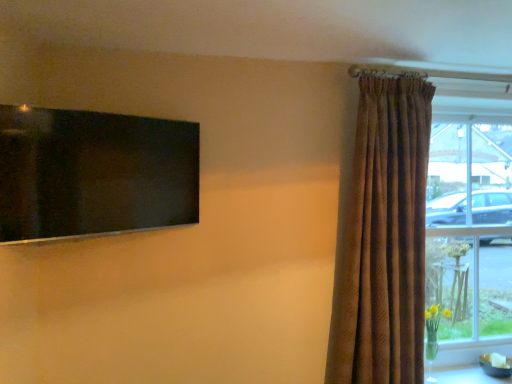
Question: Is brown textured curtain at right behind white glossy table at lower right?

Choices:
 (A) no
 (B) yes

Answer: (A)

Question: Considering the relative sizes of brown textured curtain at right and white glossy table at lower right in the image provided, is brown textured curtain at right shorter than white glossy table at lower right?

Choices:
 (A) yes
 (B) no

Answer: (B)

Question: Can you confirm if brown textured curtain at right is wider than white glossy table at lower right?

Choices:
 (A) no
 (B) yes

Answer: (A)

Question: Is brown textured curtain at right to the right of white glossy table at lower right from the viewer's perspective?

Choices:
 (A) no
 (B) yes

Answer: (A)

Question: Is brown textured curtain at right not near white glossy table at lower right?

Choices:
 (A) no
 (B) yes

Answer: (A)

Question: Is point [x=400, y=125] positioned closer to the camera than point [x=109, y=114]?

Choices:
 (A) farther
 (B) closer

Answer: (A)

Question: Is brown textured curtain at right inside the boundaries of black glossy screen at upper left, or outside?

Choices:
 (A) inside
 (B) outside

Answer: (B)

Question: Looking at their shapes, would you say brown textured curtain at right is wider or thinner than black glossy screen at upper left?

Choices:
 (A) thin
 (B) wide

Answer: (B)

Question: Considering their positions, is brown textured curtain at right located in front of or behind black glossy screen at upper left?

Choices:
 (A) behind
 (B) front

Answer: (A)

Question: In terms of width, does clear glass window at right look wider or thinner when compared to white glossy table at lower right?

Choices:
 (A) wide
 (B) thin

Answer: (B)

Question: In the image, is clear glass window at right on the left side or the right side of white glossy table at lower right?

Choices:
 (A) right
 (B) left

Answer: (A)

Question: Considering their positions, is clear glass window at right located in front of or behind white glossy table at lower right?

Choices:
 (A) behind
 (B) front

Answer: (A)

Question: From the image's perspective, relative to white glossy table at lower right, is clear glass window at right above or below?

Choices:
 (A) above
 (B) below

Answer: (A)

Question: In the image, is white glossy table at lower right positioned in front of or behind clear glass window at right?

Choices:
 (A) front
 (B) behind

Answer: (A)

Question: From the image's perspective, is white glossy table at lower right above or below clear glass window at right?

Choices:
 (A) above
 (B) below

Answer: (B)